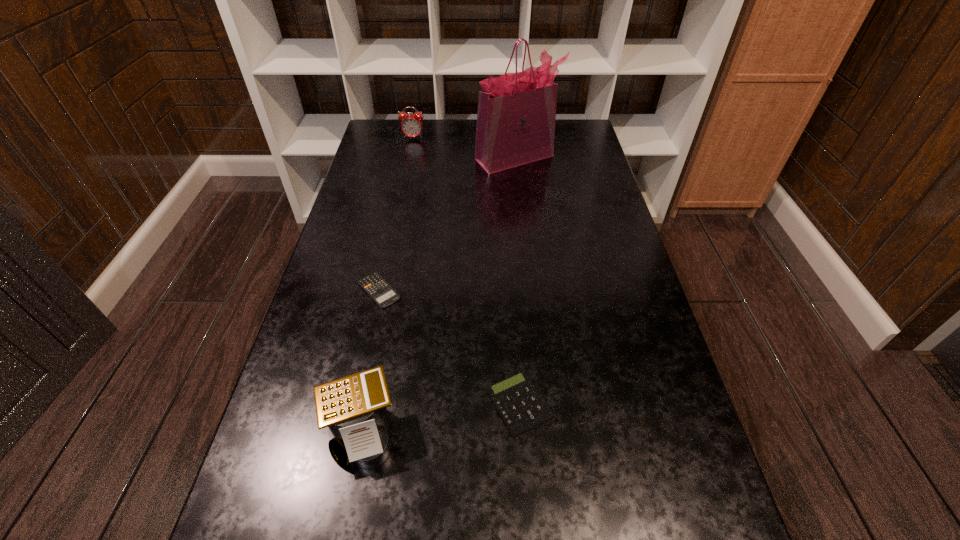
You are a GUI agent. You are given a task and a screenshot of the screen. Output one action in this format:
    pyautogui.click(x=<x>, y=<y>)
    Task: Click on the vacant area in the image that satisfies the following two spatial constraints: 1. on the face of the tallest calculator; 2. on the left side of the farthest object
    
    Given the screenshot: What is the action you would take?
    pyautogui.click(x=351, y=431)

Image resolution: width=960 pixels, height=540 pixels. I want to click on vacant area that satisfies the following two spatial constraints: 1. on the face of the farthest object; 2. on the right side of the tallest calculator, so click(x=351, y=431).

Find the location of a particular element. vacant space that satisfies the following two spatial constraints: 1. on the face of the tallest calculator; 2. on the left side of the alarm clock is located at coordinates (351, 431).

At what (x,y) coordinates should I click in order to perform the action: click on vacant position in the image that satisfies the following two spatial constraints: 1. on the back side of the tallest object; 2. on the left side of the tallest calculator. Please return your answer as a coordinate pair (x, y). Image resolution: width=960 pixels, height=540 pixels. Looking at the image, I should click on (415, 158).